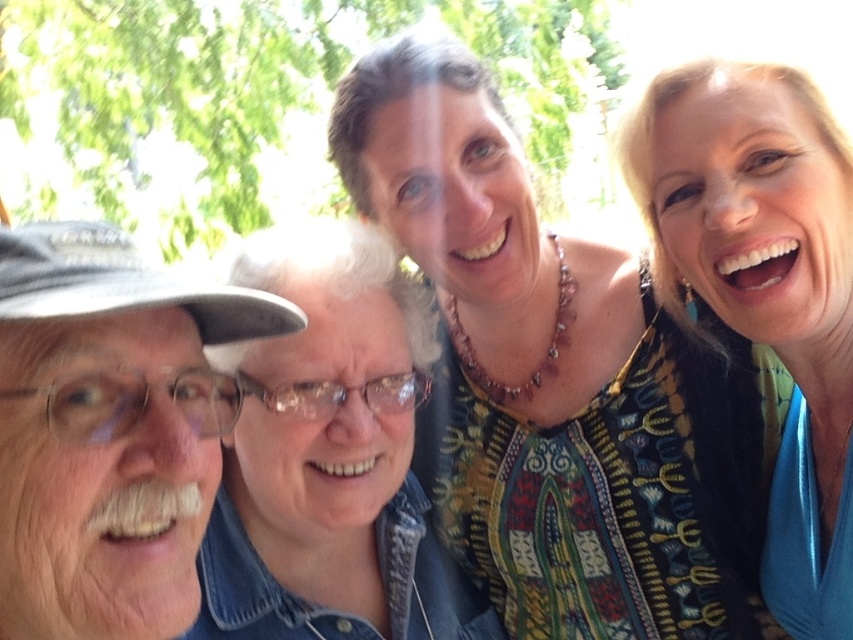
Question: Which object appears farthest from the camera in this image?

Choices:
 (A) blonde hair at upper right
 (B) white matte cap at left
 (C) multicolored fabric top at center

Answer: (C)

Question: Is multicolored fabric top at center above white matte cap at left?

Choices:
 (A) no
 (B) yes

Answer: (B)

Question: Which point is farther to the camera?

Choices:
 (A) blonde hair at upper right
 (B) multicolored fabric top at center
 (C) white matte cap at left

Answer: (B)

Question: Does multicolored fabric top at center have a greater width compared to white matte cap at left?

Choices:
 (A) yes
 (B) no

Answer: (A)

Question: Is multicolored fabric top at center positioned behind white matte cap at left?

Choices:
 (A) yes
 (B) no

Answer: (A)

Question: Which point is closer to the camera?

Choices:
 (A) white matte cap at left
 (B) multicolored fabric top at center

Answer: (A)